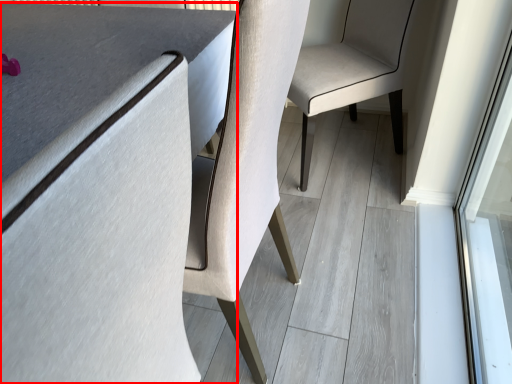
Question: Where is table (annotated by the red box) located in relation to chair in the image?

Choices:
 (A) left
 (B) right

Answer: (A)